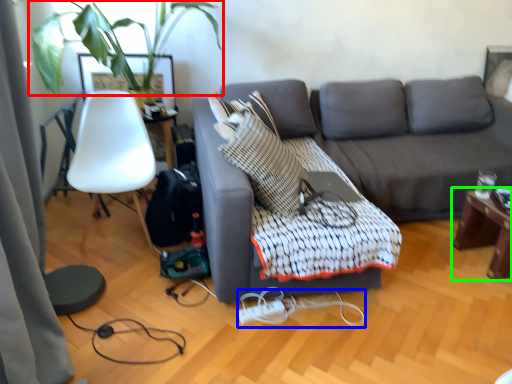
Question: Considering the real-world distances, which object is farthest from plant (highlighted by a red box)? cable (highlighted by a blue box) or table (highlighted by a green box)?

Choices:
 (A) cable
 (B) table

Answer: (B)